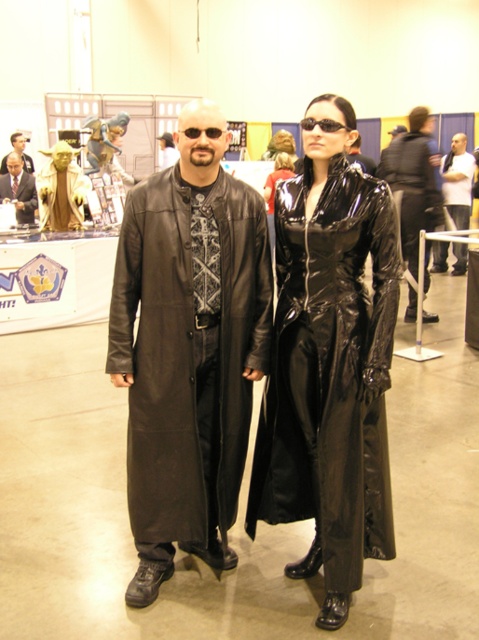
Question: Which point is closer to the camera?

Choices:
 (A) (425, 220)
 (B) (30, 161)

Answer: (A)

Question: Which point is closer to the camera taking this photo?

Choices:
 (A) (31, 189)
 (B) (455, 244)

Answer: (A)

Question: Which point appears closest to the camera in this image?

Choices:
 (A) tap(22, 221)
 (B) tap(468, 166)

Answer: (A)

Question: From the image, what is the correct spatial relationship of glossy black suit at center in relation to matte black coat at center?

Choices:
 (A) below
 (B) above

Answer: (A)

Question: Is matte black suit at center below matte black coat at center?

Choices:
 (A) yes
 (B) no

Answer: (A)

Question: Can you confirm if glossy black suit at center is thinner than matte black suit at center?

Choices:
 (A) no
 (B) yes

Answer: (B)